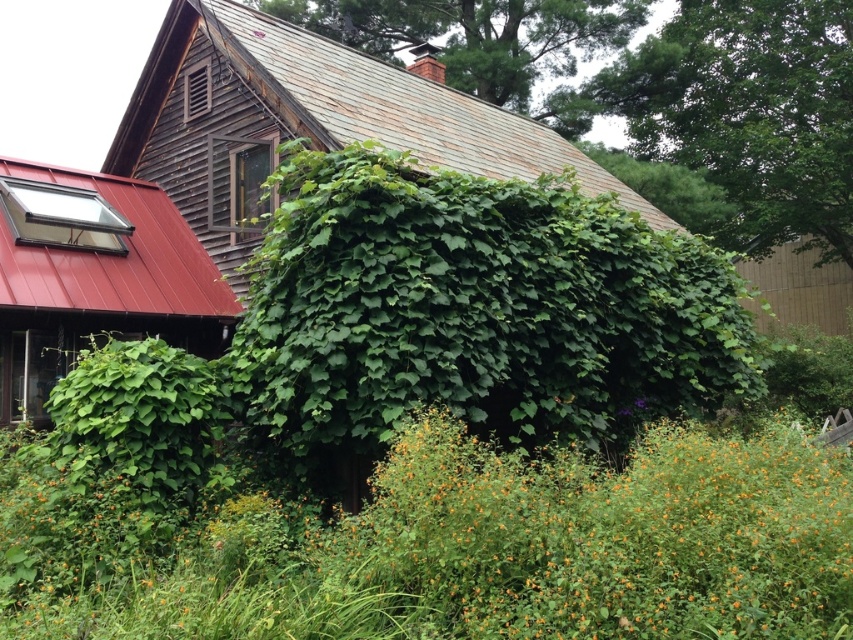
Does metallic red awning at left have a greater height compared to wooden fence at right?

Incorrect, metallic red awning at left's height is not larger of wooden fence at right's.

Can you confirm if metallic red awning at left is shorter than wooden fence at right?

Yes.

Based on the photo, who is more distant from viewer, (33, 273) or (787, 275)?

Positioned behind is point (787, 275).

Identify the location of metallic red awning at left. (94, 276).

Which is above, green leafy plant at upper right or wooden fence at right?

green leafy plant at upper right

Where is `green leafy plant at upper right`? Image resolution: width=853 pixels, height=640 pixels. green leafy plant at upper right is located at coordinates (746, 116).

Is point (819, 61) closer to viewer compared to point (784, 323)?

Yes, it is in front of point (784, 323).

Identify the location of green leafy plant at upper right. The height and width of the screenshot is (640, 853). (746, 116).

From the picture: Who is lower down, green leafy plant at upper center or wooden fence at right?

wooden fence at right is lower down.

Can you confirm if green leafy plant at upper center is thinner than wooden fence at right?

Incorrect, green leafy plant at upper center's width is not less than wooden fence at right's.

Between point (526, 24) and point (821, 316), which one is positioned in front?

Point (526, 24) is in front.

Locate an element on the screen. This screenshot has height=640, width=853. green leafy plant at upper center is located at coordinates (498, 48).